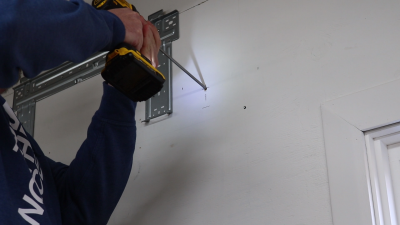
Locate an element on the screen. The image size is (400, 225). drilled hole is located at coordinates (244, 106), (205, 89).